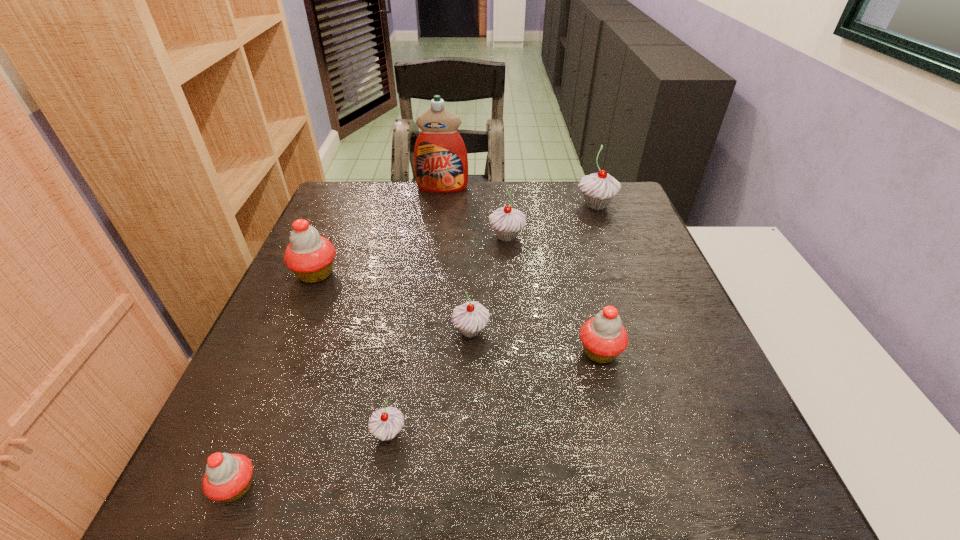
The height and width of the screenshot is (540, 960). Identify the location of the farthest object. (440, 158).

This screenshot has width=960, height=540. I want to click on the tallest object, so click(440, 158).

The width and height of the screenshot is (960, 540). In order to click on the seventh shortest object in this screenshot , I will do `click(598, 189)`.

You are a GUI agent. You are given a task and a screenshot of the screen. Output one action in this format:
    pyautogui.click(x=<x>, y=<y>)
    Task: Click on the rightmost gray cupcake
    
    Given the screenshot: What is the action you would take?
    pyautogui.click(x=598, y=189)

Where is `the sixth object from left to right`? The image size is (960, 540). the sixth object from left to right is located at coordinates (507, 222).

Where is `the second biggest gray cupcake`? the second biggest gray cupcake is located at coordinates (507, 222).

Where is `the biggest red cupcake`? the biggest red cupcake is located at coordinates 309,256.

Locate an element on the screen. This screenshot has height=540, width=960. the fifth nearest cupcake is located at coordinates (309, 256).

At what (x,y) coordinates should I click in order to perform the action: click on the second gray cupcake from left to right. Please return your answer as a coordinate pair (x, y). Looking at the image, I should click on (470, 318).

At what (x,y) coordinates should I click in order to perform the action: click on the third biggest gray cupcake. Please return your answer as a coordinate pair (x, y). The width and height of the screenshot is (960, 540). Looking at the image, I should click on (470, 318).